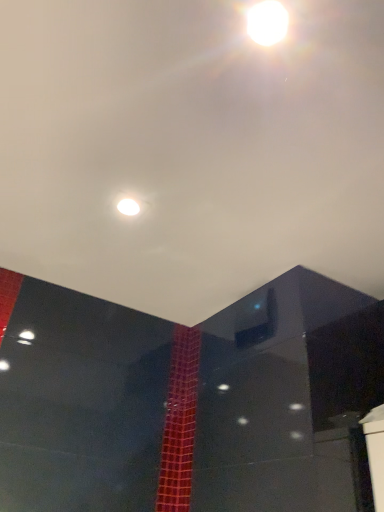
Question: Looking at their shapes, would you say white glossy light at upper center is wider or thinner than white glossy light at upper center?

Choices:
 (A) wide
 (B) thin

Answer: (B)

Question: Is white glossy light at upper center in front of or behind white glossy light at upper center in the image?

Choices:
 (A) front
 (B) behind

Answer: (A)

Question: Is white glossy light at upper center inside or outside of white glossy light at upper center?

Choices:
 (A) outside
 (B) inside

Answer: (A)

Question: Would you say white glossy light at upper center is inside or outside white glossy light at upper center?

Choices:
 (A) outside
 (B) inside

Answer: (A)

Question: From the image's perspective, relative to white glossy light at upper center, is white glossy light at upper center above or below?

Choices:
 (A) above
 (B) below

Answer: (B)

Question: Considering their positions, is white glossy light at upper center located in front of or behind white glossy light at upper center?

Choices:
 (A) behind
 (B) front

Answer: (A)

Question: In terms of size, does white glossy light at upper center appear bigger or smaller than white glossy light at upper center?

Choices:
 (A) small
 (B) big

Answer: (A)